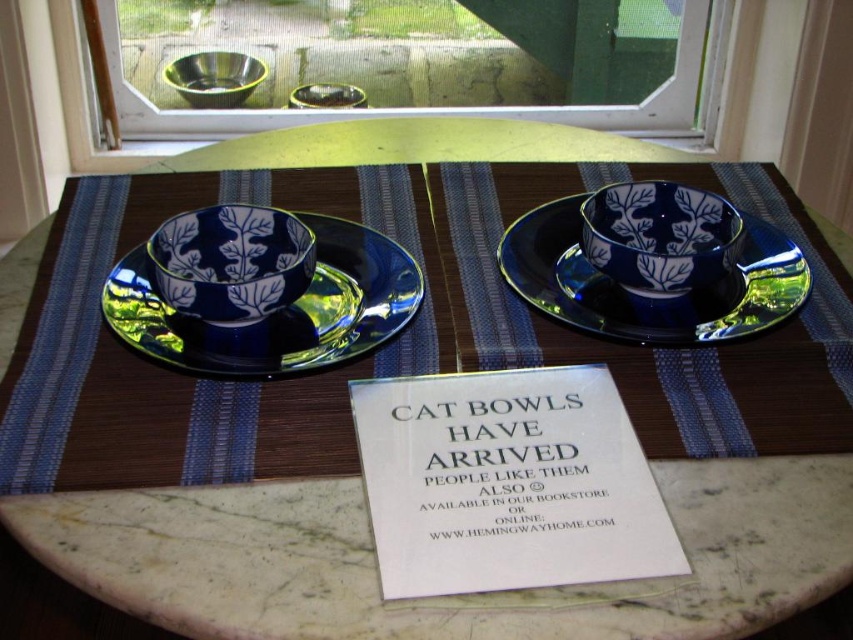
Question: Is blue glossy teacup at center to the right of blue glossy teacup at center right from the viewer's perspective?

Choices:
 (A) yes
 (B) no

Answer: (B)

Question: Which point is farther from the camera taking this photo?

Choices:
 (A) (274, 268)
 (B) (618, 218)

Answer: (B)

Question: Can you confirm if blue glass saucer at center is positioned to the right of blue glossy teacup at center right?

Choices:
 (A) yes
 (B) no

Answer: (B)

Question: Can you confirm if blue glass saucer at center is thinner than blue glossy teacup at center right?

Choices:
 (A) yes
 (B) no

Answer: (B)

Question: Among these objects, which one is nearest to the camera?

Choices:
 (A) blue glossy teacup at center
 (B) metallic bowls at upper center

Answer: (A)

Question: Which object appears farthest from the camera in this image?

Choices:
 (A) blue glass saucer at center
 (B) blue glass plate at center
 (C) blue glossy teacup at center

Answer: (B)